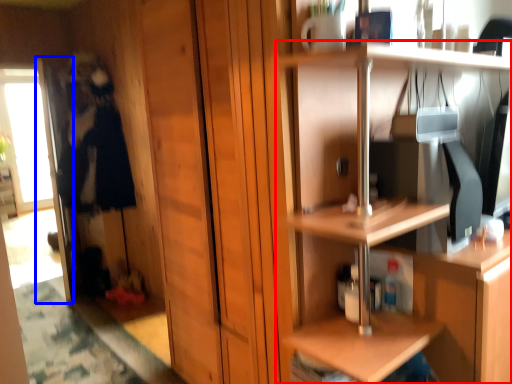
Question: Which object appears closest to the camera in this image, shelf (highlighted by a red box) or screen door (highlighted by a blue box)?

Choices:
 (A) shelf
 (B) screen door

Answer: (A)